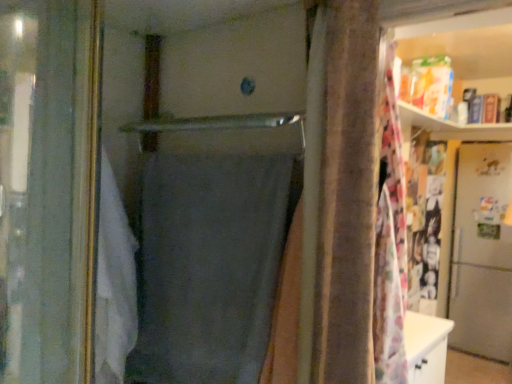
Question: Is metallic silver refrigerator at right inside the boundaries of gray matte fabric at center, or outside?

Choices:
 (A) outside
 (B) inside

Answer: (A)

Question: From a real-world perspective, is metallic silver refrigerator at right above or below gray matte fabric at center?

Choices:
 (A) above
 (B) below

Answer: (B)

Question: In terms of height, does metallic silver refrigerator at right look taller or shorter compared to gray matte fabric at center?

Choices:
 (A) tall
 (B) short

Answer: (A)

Question: From a real-world perspective, relative to metallic silver refrigerator at right, is gray matte fabric at center vertically above or below?

Choices:
 (A) below
 (B) above

Answer: (B)

Question: Looking at their shapes, would you say gray matte fabric at center is wider or thinner than metallic silver refrigerator at right?

Choices:
 (A) wide
 (B) thin

Answer: (B)

Question: Considering the relative positions of gray matte fabric at center and metallic silver refrigerator at right in the image provided, is gray matte fabric at center to the left or to the right of metallic silver refrigerator at right?

Choices:
 (A) right
 (B) left

Answer: (B)

Question: From the image's perspective, is gray matte fabric at center located above or below metallic silver refrigerator at right?

Choices:
 (A) below
 (B) above

Answer: (B)